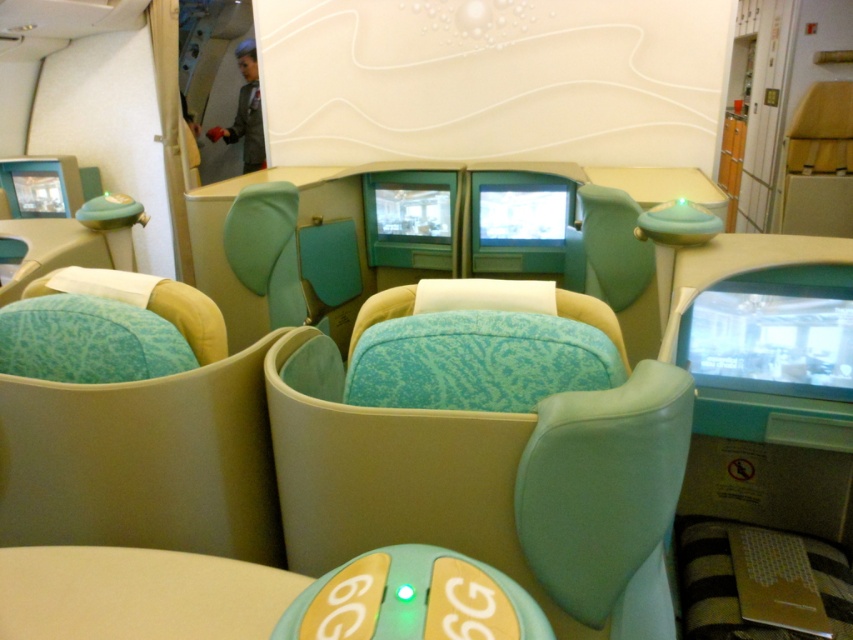
Does textured teal cushion at center appear under teal fabric seat at center?

Indeed, textured teal cushion at center is positioned under teal fabric seat at center.

Between textured teal cushion at center and teal fabric seat at center, which one is positioned higher?

teal fabric seat at center is higher up.

At what (x,y) coordinates should I click in order to perform the action: click on textured teal cushion at center. Please return your answer as a coordinate pair (x, y). Looking at the image, I should click on (148, 451).

Who is positioned more to the right, turquoise fabric seat at center or teal fabric seat at center?

turquoise fabric seat at center is more to the right.

Who is taller, turquoise fabric seat at center or teal fabric seat at center?

teal fabric seat at center is taller.

At what (x,y) coordinates should I click in order to perform the action: click on turquoise fabric seat at center. Please return your answer as a coordinate pair (x, y). Looking at the image, I should click on (483, 467).

Between turquoise fabric seat at center and textured teal cushion at center, which one has more height?

With more height is turquoise fabric seat at center.

Can you confirm if turquoise fabric seat at center is positioned to the left of textured teal cushion at center?

Incorrect, turquoise fabric seat at center is not on the left side of textured teal cushion at center.

At what (x,y) coordinates should I click in order to perform the action: click on turquoise fabric seat at center. Please return your answer as a coordinate pair (x, y). The image size is (853, 640). Looking at the image, I should click on (483, 467).